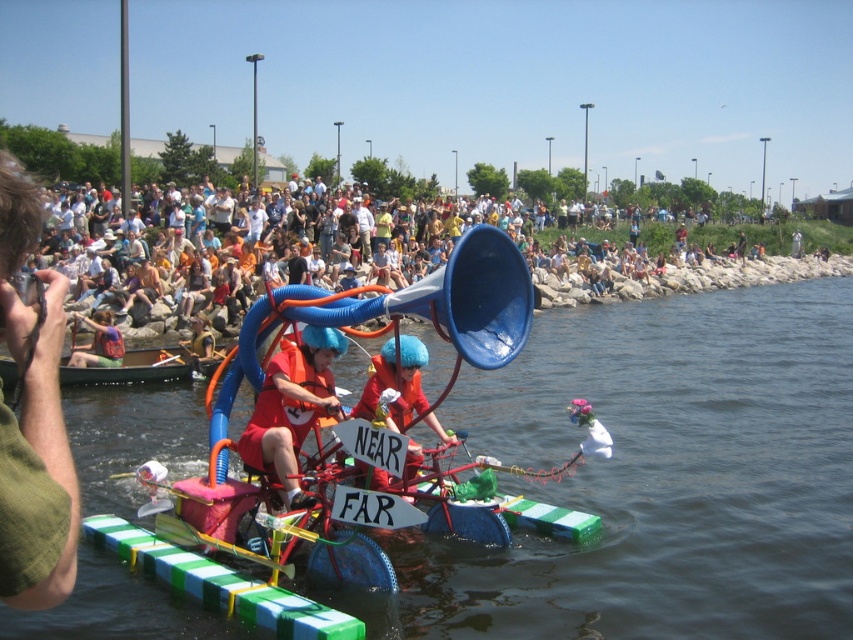
Question: Considering the relative positions of green plastic boat at center and red fabric boat at center in the image provided, where is green plastic boat at center located with respect to red fabric boat at center?

Choices:
 (A) left
 (B) right

Answer: (B)

Question: Which object is farther from the camera taking this photo?

Choices:
 (A) green plastic boat at center
 (B) red fabric shirt at center

Answer: (B)

Question: Among these points, which one is farthest from the camera?

Choices:
 (A) (196, 340)
 (B) (30, 212)
 (C) (788, 284)
 (D) (242, 451)

Answer: (C)

Question: Which object is closer to the camera taking this photo?

Choices:
 (A) red fabric boat at center
 (B) red fabric life vest at center

Answer: (B)

Question: Is red fabric helmet at center bigger than red fabric shirt at center?

Choices:
 (A) yes
 (B) no

Answer: (B)

Question: Does green fabric hand at upper left have a smaller size compared to red fabric life vest at center?

Choices:
 (A) no
 (B) yes

Answer: (A)